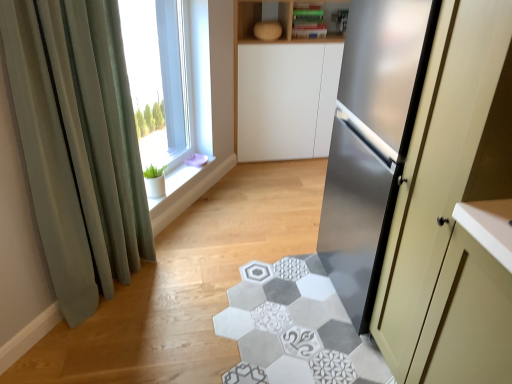
Find the location of a particular element. This screenshot has width=512, height=384. free point in front of green fabric curtain at left is located at coordinates (106, 345).